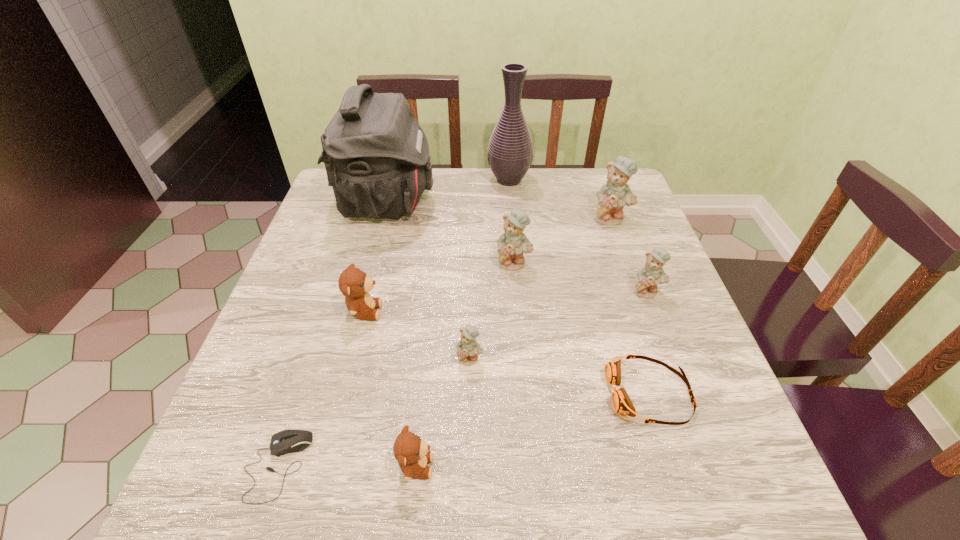
At what (x,y) coordinates should I click in order to perform the action: click on teddy bear located in the near edge section of the desktop. Please return your answer as a coordinate pair (x, y). This screenshot has width=960, height=540. Looking at the image, I should click on coord(411,452).

This screenshot has height=540, width=960. Find the location of `computer mouse situated at the near edge`. computer mouse situated at the near edge is located at coordinates (287, 441).

Image resolution: width=960 pixels, height=540 pixels. Identify the location of shoulder bag located at the left edge. (376, 155).

The height and width of the screenshot is (540, 960). What are the coordinates of `teddy bear that is at the left edge` in the screenshot? It's located at (354, 284).

Find the location of a particular element. The width and height of the screenshot is (960, 540). computer mouse present at the left edge is located at coordinates (287, 441).

Find the location of a particular element. goggles that is at the right edge is located at coordinates (621, 403).

The image size is (960, 540). I want to click on object situated at the far left corner, so click(x=376, y=155).

Locate an element on the screen. The width and height of the screenshot is (960, 540). object that is at the near left corner is located at coordinates (287, 441).

Where is `object at the far right corner`? The height and width of the screenshot is (540, 960). object at the far right corner is located at coordinates (612, 197).

Locate an element on the screen. The width and height of the screenshot is (960, 540). free space at the far edge of the desktop is located at coordinates (488, 179).